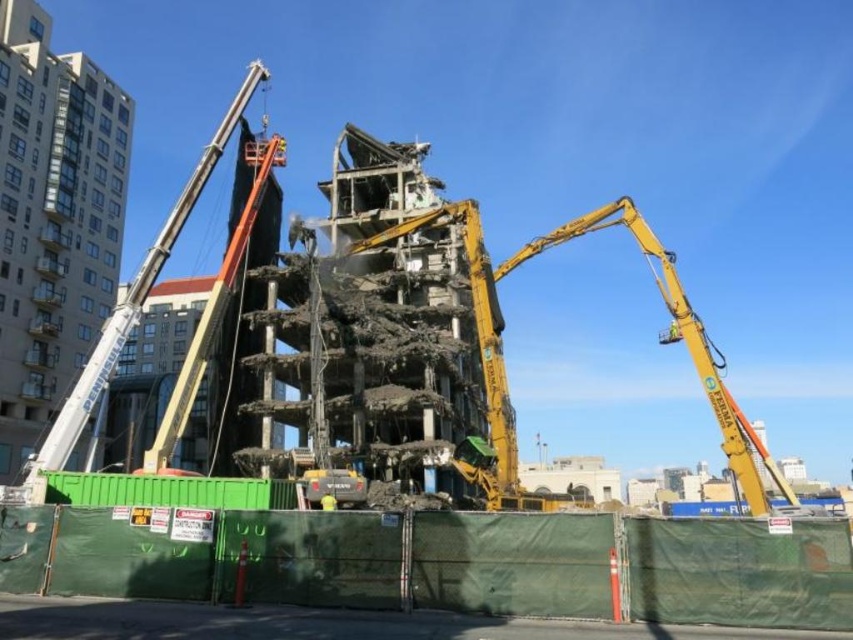
Question: Is yellow metallic arm at center smaller than orange metallic crane at left?

Choices:
 (A) no
 (B) yes

Answer: (B)

Question: Among these points, which one is nearest to the camera?

Choices:
 (A) (450, 212)
 (B) (154, 252)

Answer: (B)

Question: Does orange metallic crane at left lie in front of yellow fabric construction worker at center?

Choices:
 (A) yes
 (B) no

Answer: (A)

Question: Which point is closer to the camera taking this photo?

Choices:
 (A) (105, 333)
 (B) (320, 506)
 (C) (496, 273)

Answer: (B)

Question: Can you confirm if yellow metallic arm at center is wider than orange metallic crane at left?

Choices:
 (A) no
 (B) yes

Answer: (A)

Question: Estimate the real-world distances between objects in this image. Which object is farther from the orange metallic crane at left?

Choices:
 (A) yellow fabric construction worker at center
 (B) yellow metallic arm at center

Answer: (A)